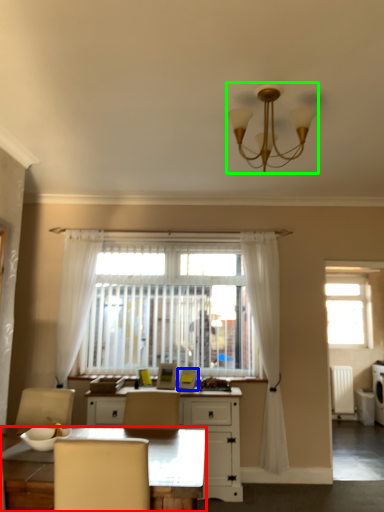
Question: Which is nearer to the desk (highlighted by a red box)? picture frame (highlighted by a blue box) or lamp (highlighted by a green box).

Choices:
 (A) picture frame
 (B) lamp

Answer: (B)